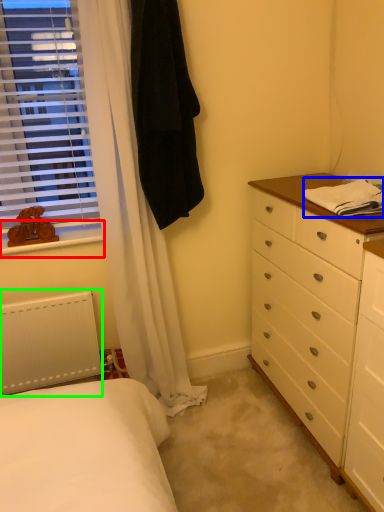
Question: Which object is positioned closest to window sill (highlighted by a red box)? Select from blanket (highlighted by a blue box) and radiator (highlighted by a green box).

Choices:
 (A) blanket
 (B) radiator

Answer: (B)